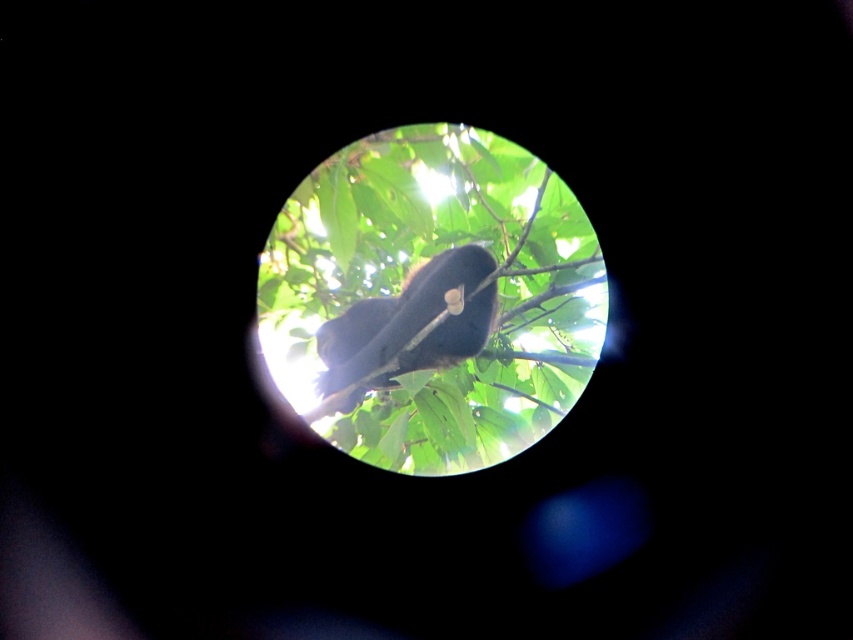
Question: Observing the image, what is the correct spatial positioning of green leafy tree at center in reference to shiny black monkey at center?

Choices:
 (A) left
 (B) right

Answer: (B)

Question: Among these objects, which one is nearest to the camera?

Choices:
 (A) shiny black monkey at center
 (B) green leafy tree at center

Answer: (B)

Question: Which of the following is the closest to the observer?

Choices:
 (A) shiny black monkey at center
 (B) green leafy tree at center

Answer: (B)

Question: Does green leafy tree at center have a greater width compared to shiny black monkey at center?

Choices:
 (A) no
 (B) yes

Answer: (B)

Question: Can you confirm if green leafy tree at center is positioned above shiny black monkey at center?

Choices:
 (A) no
 (B) yes

Answer: (B)

Question: Among these objects, which one is nearest to the camera?

Choices:
 (A) green leafy tree at center
 (B) shiny black monkey at center

Answer: (A)